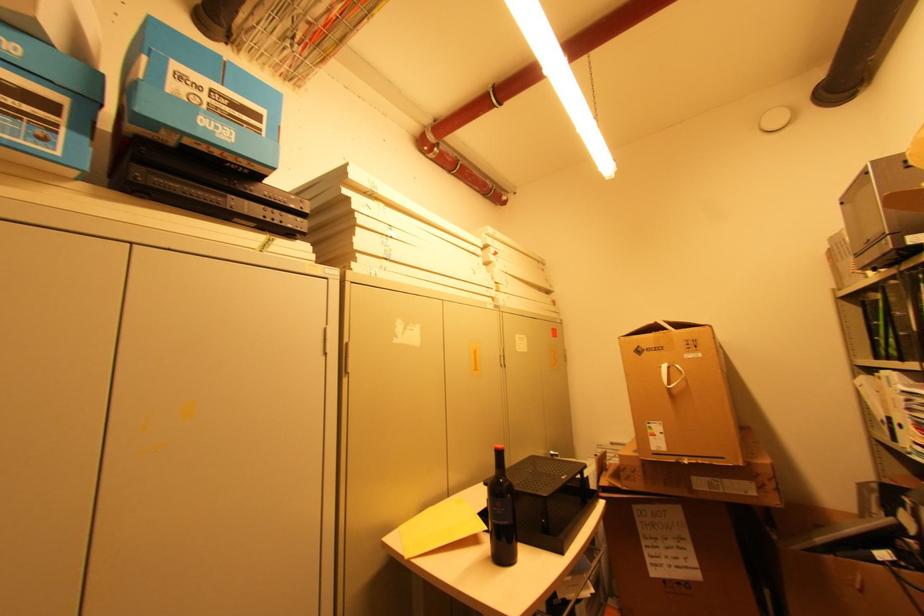
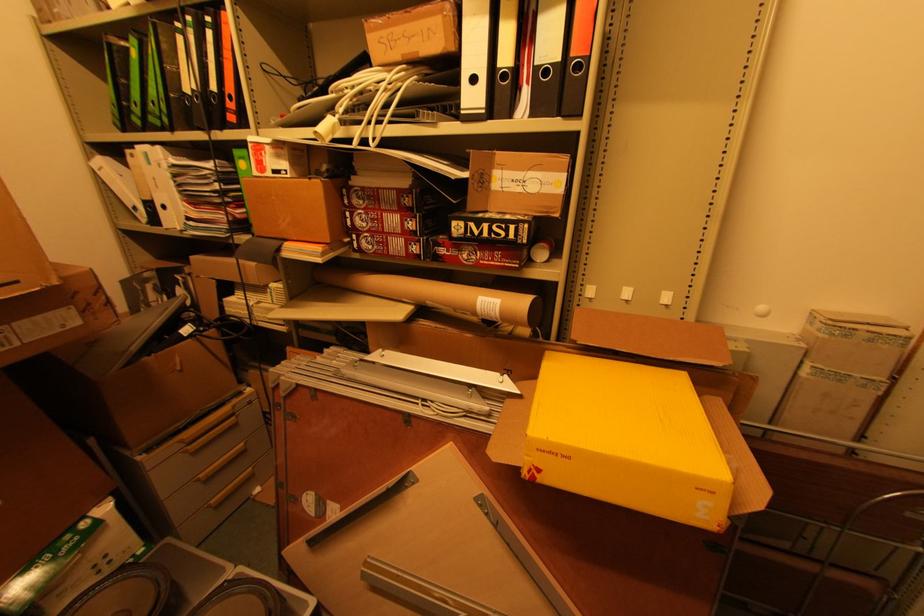
How did the camera likely rotate?

The camera's rotation is toward right-down.